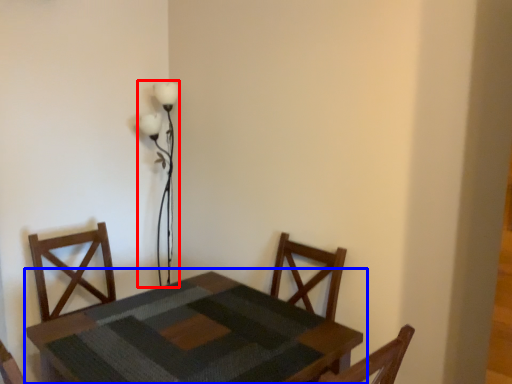
Question: Which of the following is the farthest to the observer, table lamp (highlighted by a red box) or table (highlighted by a blue box)?

Choices:
 (A) table lamp
 (B) table

Answer: (A)